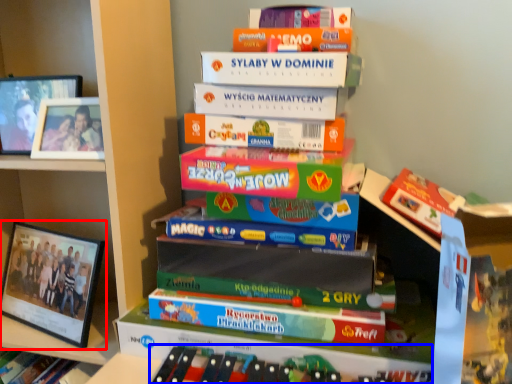
Question: Which object appears farthest to the camera in this image, picture frame (highlighted by a red box) or book (highlighted by a blue box)?

Choices:
 (A) picture frame
 (B) book

Answer: (A)